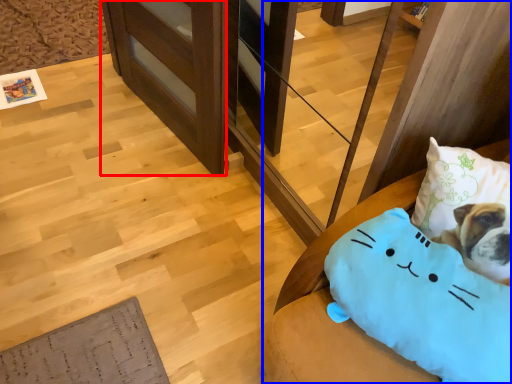
Question: Which object is closer to the camera taking this photo, shelf (highlighted by a red box) or furniture (highlighted by a blue box)?

Choices:
 (A) shelf
 (B) furniture

Answer: (B)